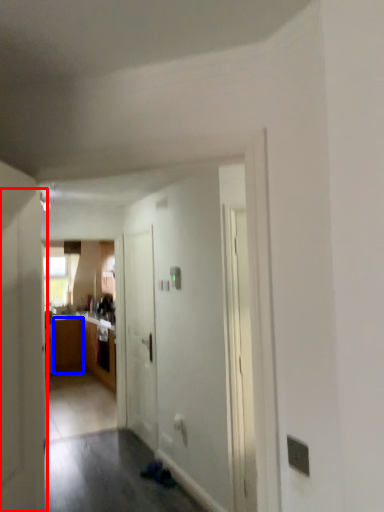
Question: Among these objects, which one is farthest to the camera, door (highlighted by a red box) or cabinetry (highlighted by a blue box)?

Choices:
 (A) door
 (B) cabinetry

Answer: (B)